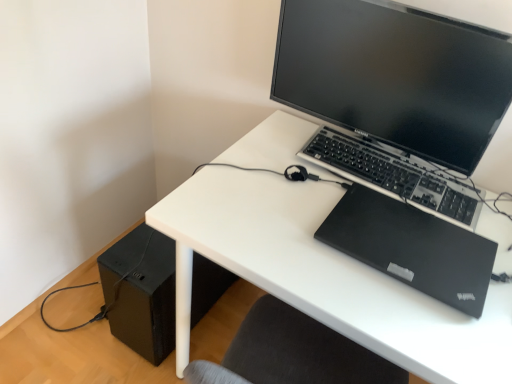
Where is `free space in front of black plastic keyboard at center`? This screenshot has width=512, height=384. free space in front of black plastic keyboard at center is located at coordinates (368, 293).